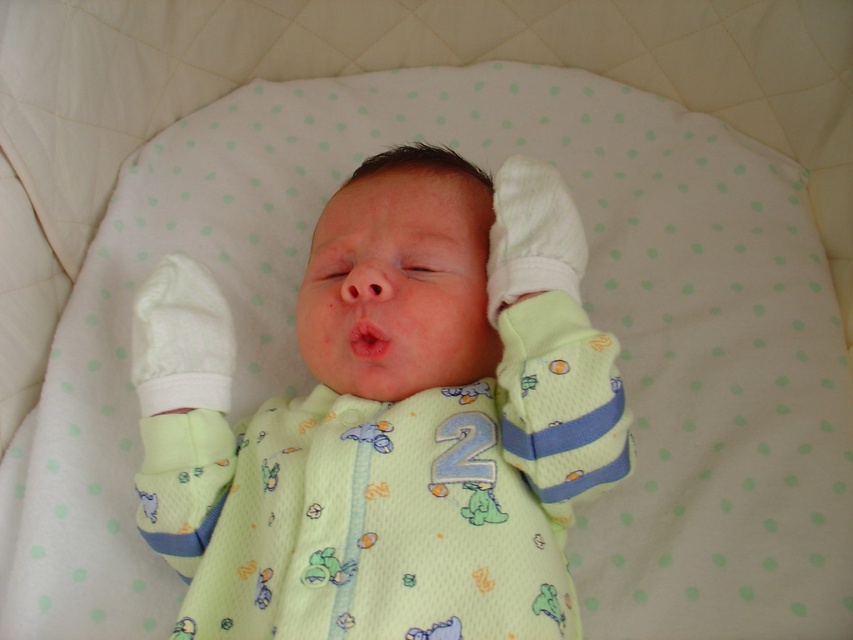
You are a photographer taking a picture of the newborn baby. You notice two points in the image, one at point coordinates point (421, 236) and another at point coordinates point (381, 342). Which point is closer to your camera?

Point (421, 236) is further to the camera than point (381, 342), so the point closer to the camera is point (381, 342).

Based on the photo, you are a nurse checking the baby in the bassinet. You need to determine if the light green jersey at center will cover the pink smooth flesh at center completely. Based on the size comparison between the two, what is your assessment?

The light green jersey at center might be wider than pink smooth flesh at center, so there is a possibility that the light green jersey at center could cover the pink smooth flesh at center completely depending on how it is positioned.